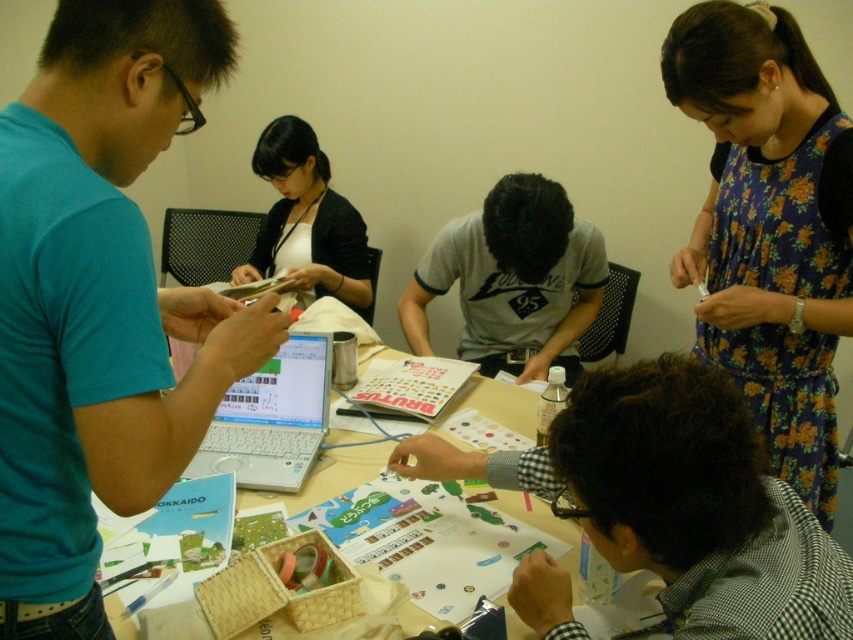
Question: Which point appears farthest from the camera in this image?

Choices:
 (A) (292, 125)
 (B) (212, 365)

Answer: (A)

Question: Can you confirm if white plastic laptop at center is thinner than white paper at center?

Choices:
 (A) yes
 (B) no

Answer: (B)

Question: Which point is farther from the camera taking this photo?

Choices:
 (A) (294, 426)
 (B) (486, 205)
 (C) (64, 404)

Answer: (B)

Question: Is blue matte shirt at left below white plastic laptop at center?

Choices:
 (A) no
 (B) yes

Answer: (A)

Question: Is white plastic laptop at center positioned at the back of white paper at center?

Choices:
 (A) no
 (B) yes

Answer: (B)

Question: Among these points, which one is farthest from the camera?

Choices:
 (A) (285, 275)
 (B) (787, 152)
 (C) (115, 477)

Answer: (A)